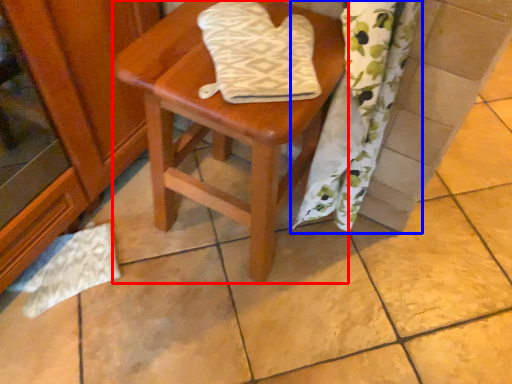
Question: Which object appears farthest to the camera in this image, stool (highlighted by a red box) or curtain (highlighted by a blue box)?

Choices:
 (A) stool
 (B) curtain

Answer: (A)